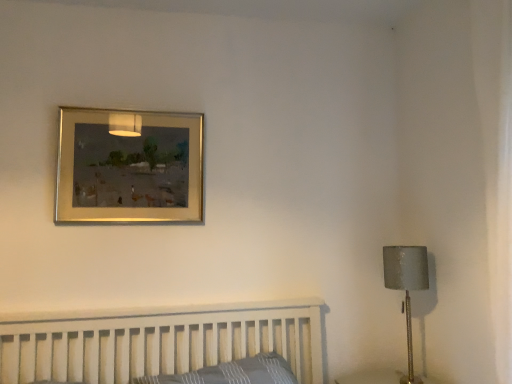
Question: From a real-world perspective, is matte gray lampshade at right located higher than gold metallic picture frame at upper center?

Choices:
 (A) no
 (B) yes

Answer: (A)

Question: Are matte gray lampshade at right and gold metallic picture frame at upper center making contact?

Choices:
 (A) yes
 (B) no

Answer: (B)

Question: Does matte gray lampshade at right have a greater width compared to gold metallic picture frame at upper center?

Choices:
 (A) no
 (B) yes

Answer: (B)

Question: From a real-world perspective, is matte gray lampshade at right positioned under gold metallic picture frame at upper center based on gravity?

Choices:
 (A) no
 (B) yes

Answer: (B)

Question: Is matte gray lampshade at right to the right of gold metallic picture frame at upper center from the viewer's perspective?

Choices:
 (A) yes
 (B) no

Answer: (A)

Question: Is matte gray lampshade at right bigger than gold metallic picture frame at upper center?

Choices:
 (A) no
 (B) yes

Answer: (B)

Question: Is gold metallic picture frame at upper center far from matte gray lampshade at right?

Choices:
 (A) no
 (B) yes

Answer: (B)

Question: Considering the relative sizes of gold metallic picture frame at upper center and matte gray lampshade at right in the image provided, is gold metallic picture frame at upper center thinner than matte gray lampshade at right?

Choices:
 (A) yes
 (B) no

Answer: (A)

Question: Is matte gray lampshade at right at the back of gold metallic picture frame at upper center?

Choices:
 (A) yes
 (B) no

Answer: (B)

Question: Can you see gold metallic picture frame at upper center touching matte gray lampshade at right?

Choices:
 (A) no
 (B) yes

Answer: (A)

Question: Is gold metallic picture frame at upper center to the left of matte gray lampshade at right from the viewer's perspective?

Choices:
 (A) yes
 (B) no

Answer: (A)

Question: Is gold metallic picture frame at upper center smaller than matte gray lampshade at right?

Choices:
 (A) no
 (B) yes

Answer: (B)

Question: Can you confirm if gold metallic picture frame at upper center is positioned to the right of gray plaid pillow at lower center?

Choices:
 (A) no
 (B) yes

Answer: (A)